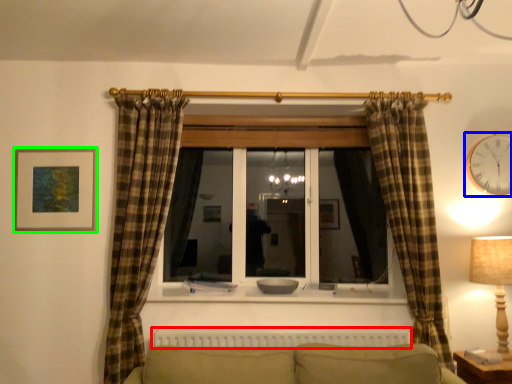
Question: Which object is the farthest from radiator (highlighted by a red box)? Choose among these: clock (highlighted by a blue box) or picture frame (highlighted by a green box).

Choices:
 (A) clock
 (B) picture frame

Answer: (A)